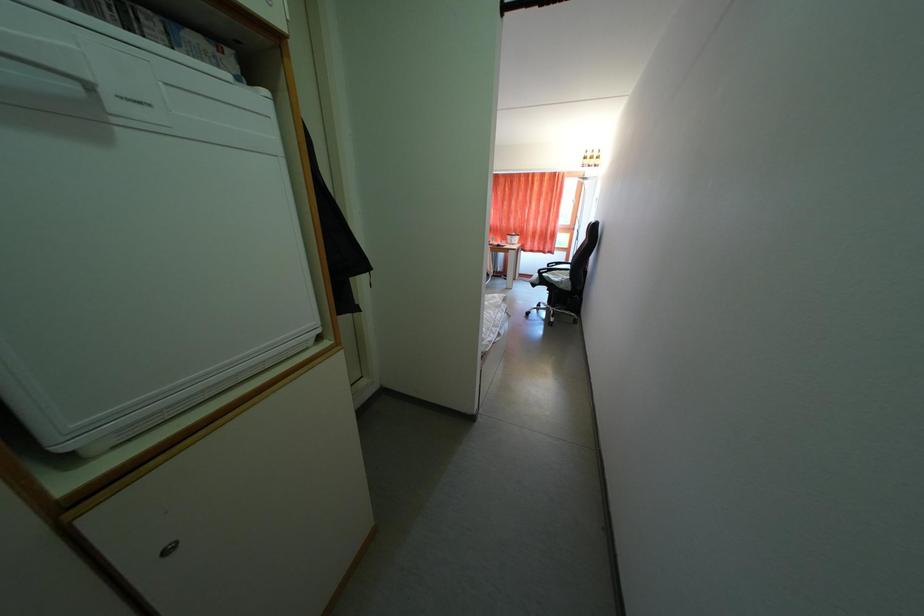
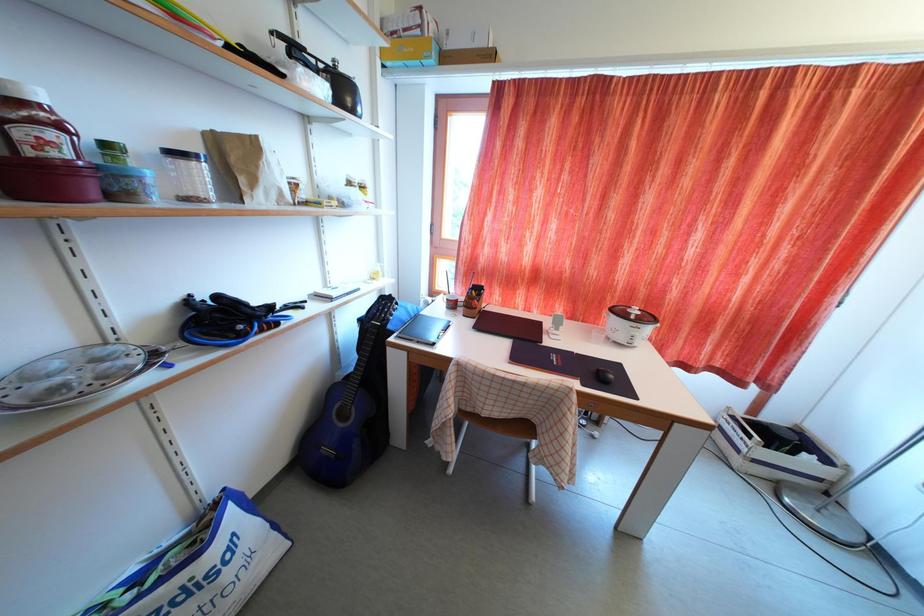
Question: The images are taken continuously from a first-person perspective. In which direction are you moving?

Choices:
 (A) Left
 (B) Right
 (C) Forward
 (D) Backward

Answer: (C)